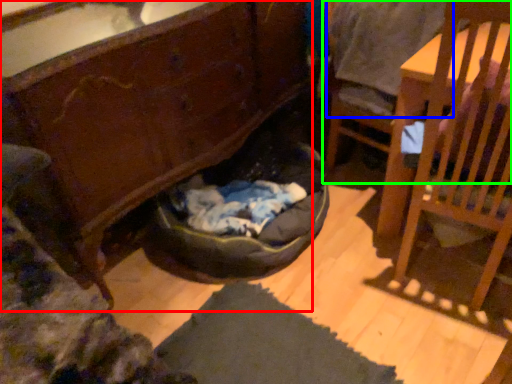
Question: Which is farther away from cabinetry (highlighted by a red box)? clothing (highlighted by a blue box) or chair (highlighted by a green box)?

Choices:
 (A) clothing
 (B) chair

Answer: (B)